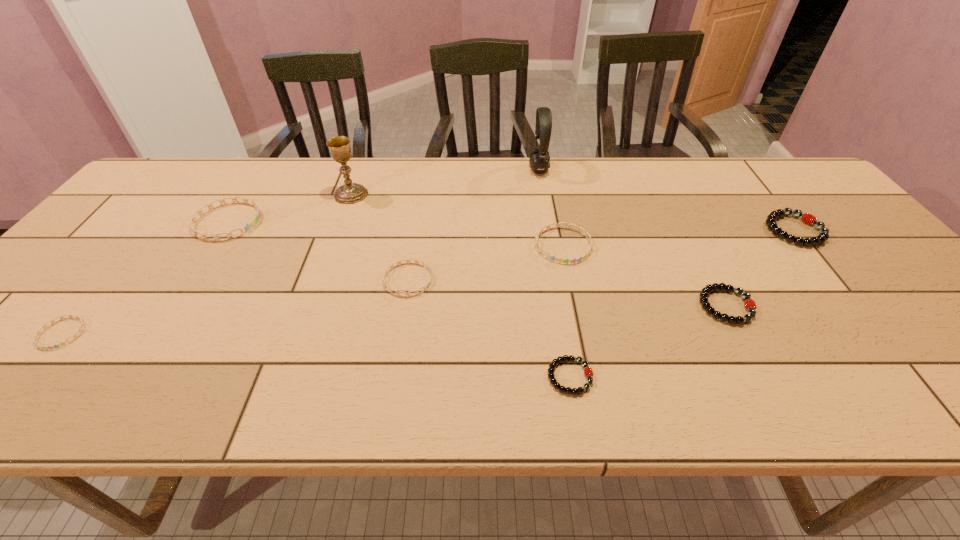
Where is `the sixth object from right to left`? the sixth object from right to left is located at coordinates (417, 261).

I want to click on the third bracelet from left to right, so click(x=417, y=261).

Locate an element on the screen. This screenshot has width=960, height=540. the nearest object is located at coordinates (588, 372).

Where is `the smallest black bracelet`? the smallest black bracelet is located at coordinates (588, 372).

Where is `the leftmost object`? The image size is (960, 540). the leftmost object is located at coordinates (83, 323).

I want to click on the leftmost bracelet, so click(83, 323).

Image resolution: width=960 pixels, height=540 pixels. Identify the location of vacant area located 0.190m on the front-facing side of the headset. (469, 169).

The width and height of the screenshot is (960, 540). What are the coordinates of `blank space located on the front-facing side of the headset` in the screenshot? It's located at [x=494, y=169].

Image resolution: width=960 pixels, height=540 pixels. In order to click on free space located on the front-facing side of the headset in this screenshot , I will do `click(420, 169)`.

Identify the location of vacant position located on the left of the gold chalice. Image resolution: width=960 pixels, height=540 pixels. (216, 194).